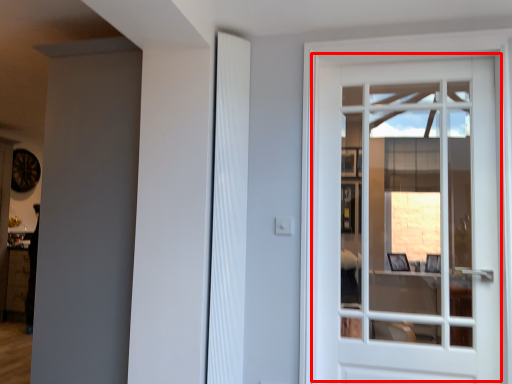
Question: In this image, where is door (annotated by the red box) located relative to shutter?

Choices:
 (A) left
 (B) right

Answer: (B)